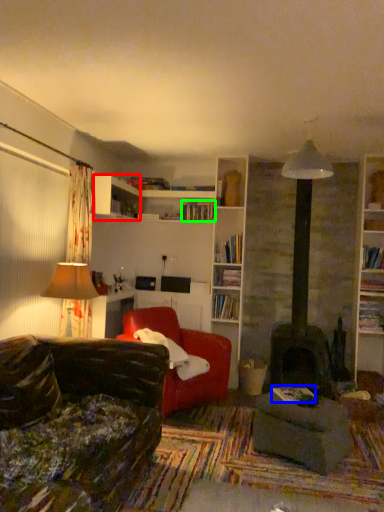
Question: Which object is the closest to the shelf (highlighted by a red box)? Choose among these: book (highlighted by a blue box) or book (highlighted by a green box).

Choices:
 (A) book
 (B) book

Answer: (B)